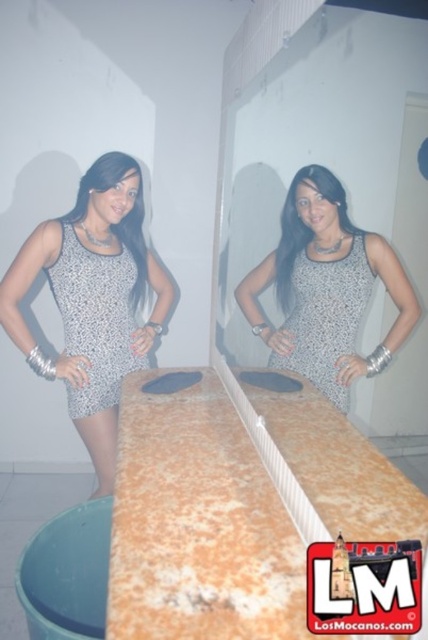
Question: Among these objects, which one is farthest from the camera?

Choices:
 (A) silver metallic dress at center
 (B) orange marble countertop at center
 (C) matte silver dress at center
 (D) speckled fabric dress at center

Answer: (A)

Question: Is silver metallic dress at center closer to camera compared to gray dotted dress at center?

Choices:
 (A) yes
 (B) no

Answer: (B)

Question: Which point is closer to the camera taking this photo?

Choices:
 (A) (115, 401)
 (B) (324, 316)
 (C) (356, 292)

Answer: (C)

Question: Observing the image, what is the correct spatial positioning of matte silver dress at center in reference to gray dotted dress at center?

Choices:
 (A) above
 (B) below

Answer: (A)

Question: Considering the real-world distances, which object is closest to the matte silver dress at center?

Choices:
 (A) silver metallic dress at center
 (B) gray dotted dress at center
 (C) orange marble countertop at center

Answer: (B)

Question: Does speckled fabric dress at center appear on the left side of gray dotted dress at center?

Choices:
 (A) no
 (B) yes

Answer: (B)